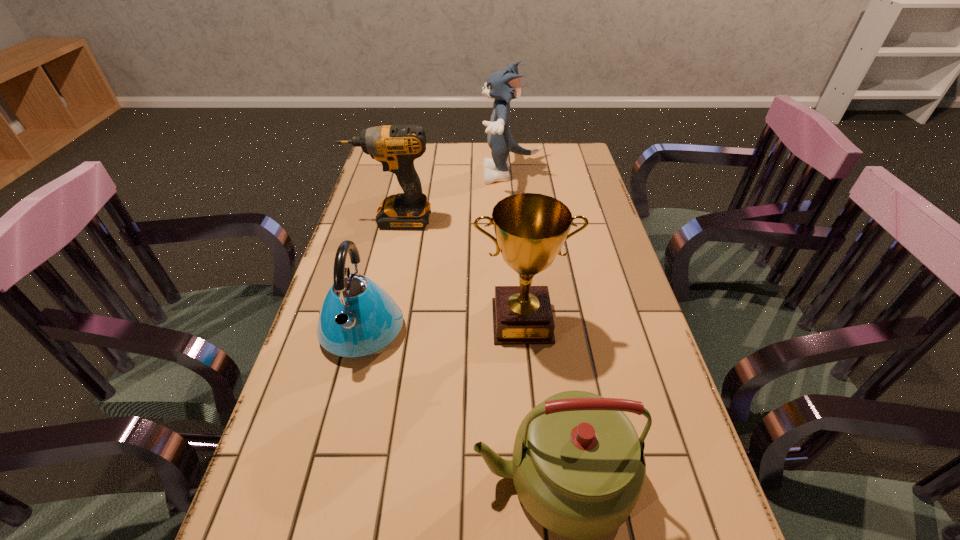
This screenshot has height=540, width=960. What are the coordinates of `the farthest object` in the screenshot? It's located at point(502,86).

Find the location of `the tallest object`. the tallest object is located at coordinates pyautogui.click(x=502, y=86).

The width and height of the screenshot is (960, 540). What are the coordinates of `award` in the screenshot? It's located at (530, 229).

Find the location of a particular element. This screenshot has width=960, height=540. drill is located at coordinates (396, 146).

This screenshot has width=960, height=540. I want to click on the left kettle, so click(358, 319).

The width and height of the screenshot is (960, 540). In order to click on free space located on the front-facing side of the farthest object in this screenshot , I will do `click(393, 174)`.

At what (x,y) coordinates should I click in order to perform the action: click on free point located on the front-facing side of the farthest object. Please return your answer as a coordinate pair (x, y). Image resolution: width=960 pixels, height=540 pixels. Looking at the image, I should click on (390, 174).

Image resolution: width=960 pixels, height=540 pixels. Find the location of `vacant space situated 0.100m on the front-facing side of the farthest object`. vacant space situated 0.100m on the front-facing side of the farthest object is located at coordinates (454, 174).

Identify the location of vacant space situated on the plaque of the award. (526, 369).

Image resolution: width=960 pixels, height=540 pixels. Identify the location of free region located at the spout of the farther kettle. (341, 416).